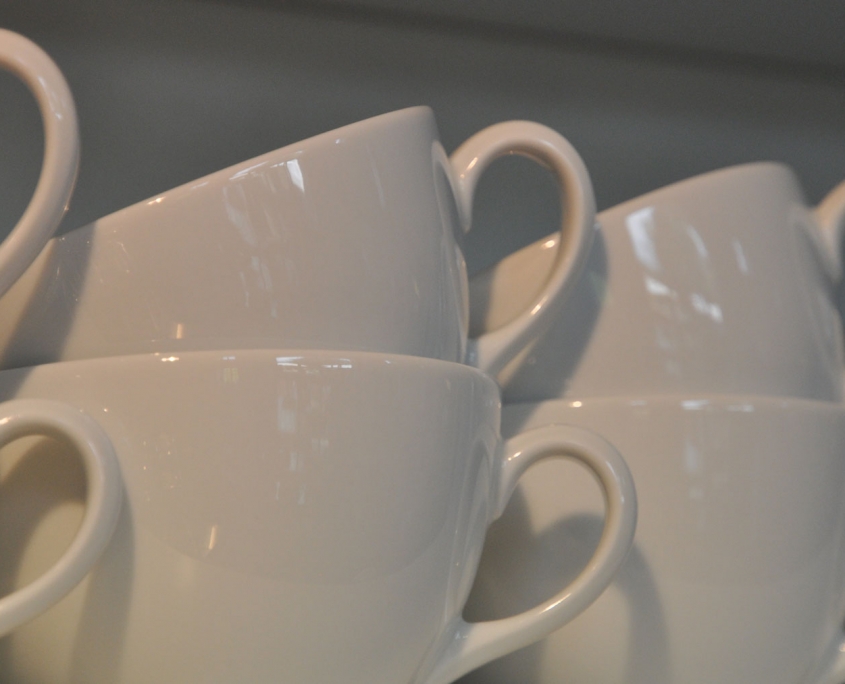
At what (x,y) coordinates should I click in order to perform the action: click on white coffee mugs. Please return your answer as a coordinate pair (x, y). The height and width of the screenshot is (684, 845). Looking at the image, I should click on (733, 265), (699, 436), (395, 237), (357, 434), (28, 241), (89, 443).